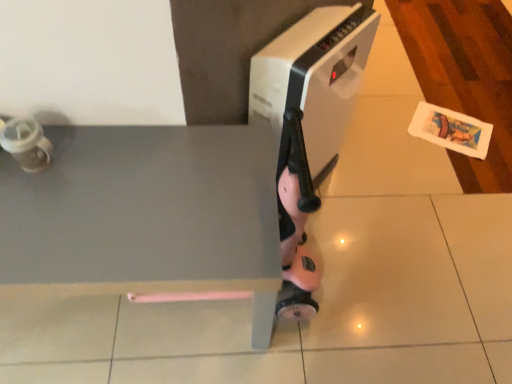
Locate an element on the screen. The height and width of the screenshot is (384, 512). empty space that is ontop of matte gray table at lower left (from a real-world perspective) is located at coordinates (119, 200).